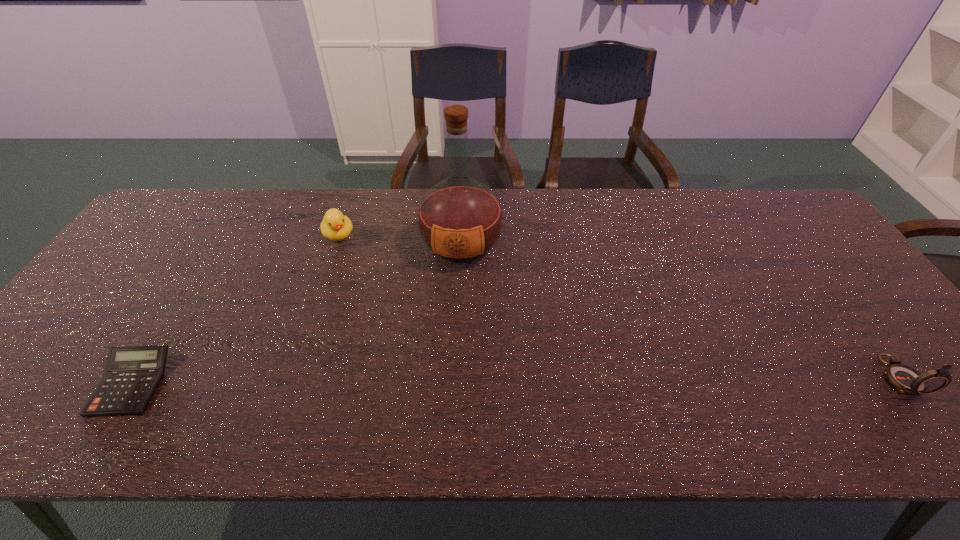
At what (x,y) coordinates should I click in order to perform the action: click on vacant space at the near edge of the desktop. Please return your answer as a coordinate pair (x, y). Image resolution: width=960 pixels, height=540 pixels. Looking at the image, I should click on (619, 391).

Where is `vacant area at the right edge of the desktop`? The width and height of the screenshot is (960, 540). vacant area at the right edge of the desktop is located at coordinates (828, 264).

In the image, there is a desktop. At what (x,y) coordinates should I click in order to perform the action: click on vacant space at the far left corner. Please return your answer as a coordinate pair (x, y). The height and width of the screenshot is (540, 960). Looking at the image, I should click on (156, 230).

The image size is (960, 540). I want to click on free space at the near left corner of the desktop, so click(x=62, y=375).

In the image, there is a desktop. Where is `vacant space at the far right corner`? Image resolution: width=960 pixels, height=540 pixels. vacant space at the far right corner is located at coordinates coord(781,217).

This screenshot has width=960, height=540. In order to click on empty space between the compass and the leftmost object in this screenshot , I will do `click(516, 380)`.

Find the location of `free point between the compass and the third object from right to left`. free point between the compass and the third object from right to left is located at coordinates (619, 306).

Locate an element on the screen. vacant region between the tallest object and the calculator is located at coordinates (297, 314).

Locate an element on the screen. This screenshot has width=960, height=540. unoccupied position between the second object from left to right and the second object from right to left is located at coordinates (400, 239).

What are the coordinates of `blank region between the liquor and the leftmost object` in the screenshot? It's located at (297, 314).